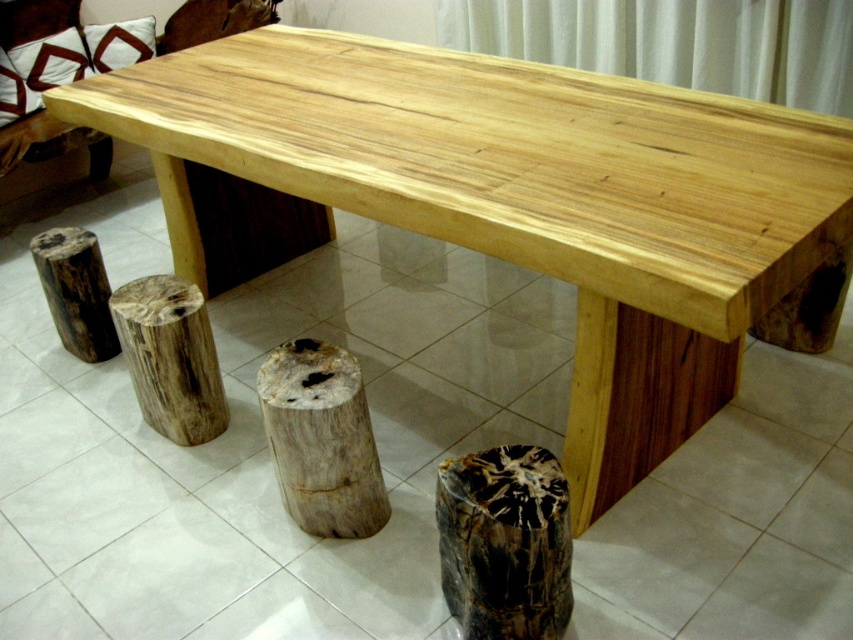
Who is positioned more to the right, black petrified wood stump at lower center or natural wood stump at lower center?

black petrified wood stump at lower center is more to the right.

Is black petrified wood stump at lower center above natural wood stump at lower center?

No.

Find the location of a particular element. black petrified wood stump at lower center is located at coordinates (503, 541).

Locate an element on the screen. Image resolution: width=853 pixels, height=640 pixels. black petrified wood stump at lower center is located at coordinates (503, 541).

Consider the image. Who is positioned more to the right, black petrified wood stump at lower center or brown rough wood stump at lower left?

black petrified wood stump at lower center is more to the right.

Describe the element at coordinates (503, 541) in the screenshot. I see `black petrified wood stump at lower center` at that location.

What are the coordinates of `black petrified wood stump at lower center` in the screenshot? It's located at (503, 541).

Is natural wood stump at center thinner than brown rough wood stump at lower left?

Incorrect, natural wood stump at center's width is not less than brown rough wood stump at lower left's.

Which is behind, point (312, 362) or point (42, 264)?

Point (42, 264)

Between point (335, 426) and point (49, 298), which one is positioned in front?

Positioned in front is point (335, 426).

The height and width of the screenshot is (640, 853). Identify the location of natural wood stump at center. (321, 440).